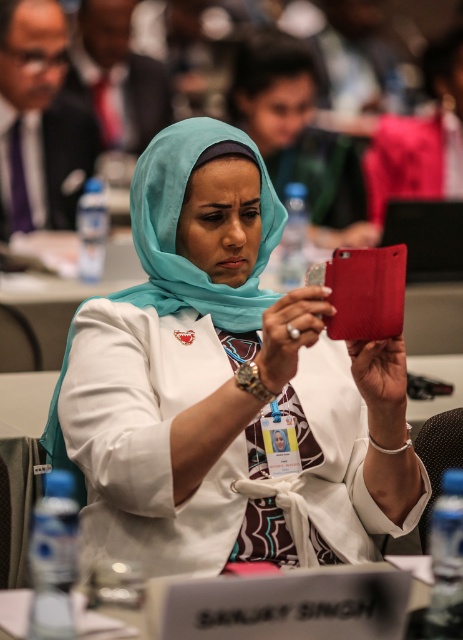
Question: Does matte white shirt at center lie behind matte black water bottle at left?

Choices:
 (A) no
 (B) yes

Answer: (A)

Question: From the image, what is the correct spatial relationship of matte white shirt at center in relation to matte black water bottle at left?

Choices:
 (A) below
 (B) above

Answer: (A)

Question: Among these objects, which one is farthest from the camera?

Choices:
 (A) matte white shirt at center
 (B) matte black water bottle at left

Answer: (B)

Question: Does matte white shirt at center appear on the right side of matte black water bottle at left?

Choices:
 (A) yes
 (B) no

Answer: (A)